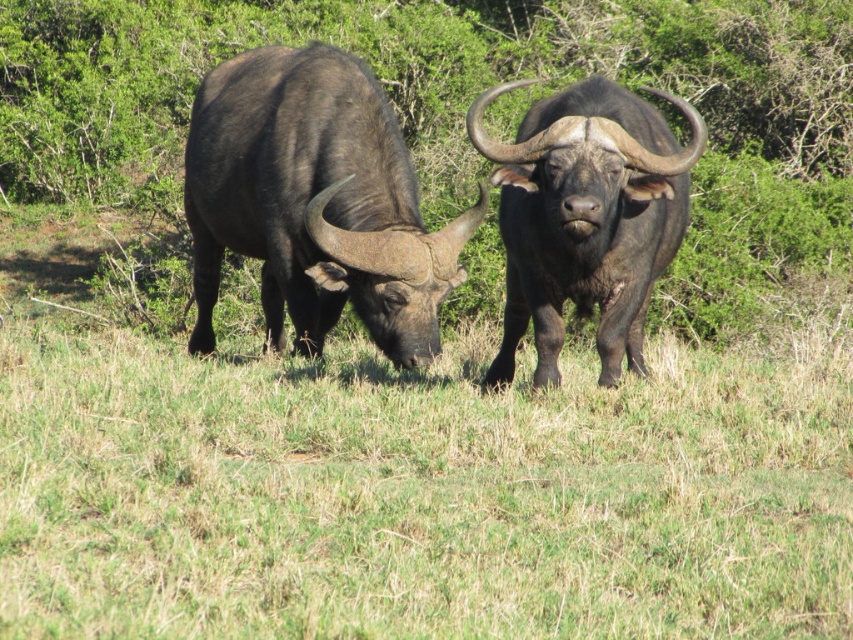
You are a wildlife photographer aiming to capture a close shot of the buffalo on the left. You notice two points in the image marked as point coordinates. Which point, point (345, 506) or point (520, 218), is closer to you and would provide a better vantage point for the photo?

Point (345, 506) is closer to the viewer than point (520, 218), so it would provide a better vantage point for capturing a close shot of the buffalo on the left.

You are a photographer trying to capture the two buffaloes in the image. To ensure the green grass at lower center is visible in the foreground, where should you position your camera relative to the buffaloes?

The green grass at lower center is located at point [416,493], so you should position your camera slightly to the right and lower than the center to include the green grass at lower center in the foreground while framing the buffaloes.